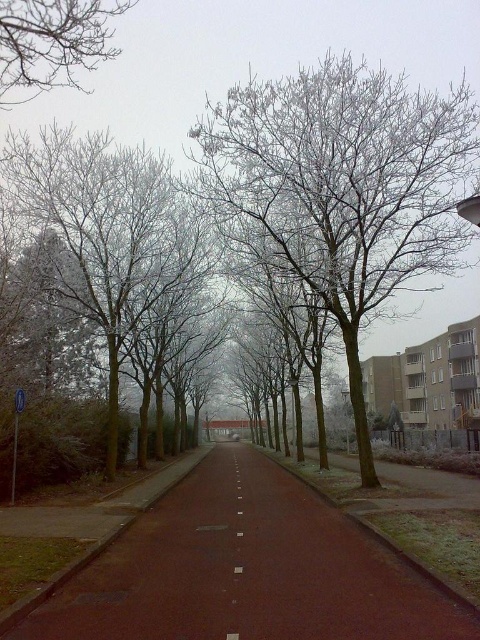
Measure the distance from bare branches at upper left to white matte line at center.

They are 21.20 meters apart.

Describe the element at coordinates (52, 44) in the screenshot. I see `bare branches at upper left` at that location.

Identify the location of bare branches at upper left. The image size is (480, 640). (52, 44).

Looking at this image, does white frosty tree at center appear under white matte line at center?

Incorrect, white frosty tree at center is not positioned below white matte line at center.

Does white frosty tree at center have a lesser height compared to white matte line at center?

In fact, white frosty tree at center may be taller than white matte line at center.

Find the location of `white frosty tree at center`. white frosty tree at center is located at coordinates (342, 188).

Can you confirm if frosted branches at left is positioned to the left of bare branches at upper left?

No, frosted branches at left is not to the left of bare branches at upper left.

Which is behind, point (91, 157) or point (81, 86)?

Point (81, 86)

Between point (70, 237) and point (71, 36), which one is positioned behind?

The point (70, 237) is more distant.

The width and height of the screenshot is (480, 640). I want to click on frosted branches at left, so click(107, 236).